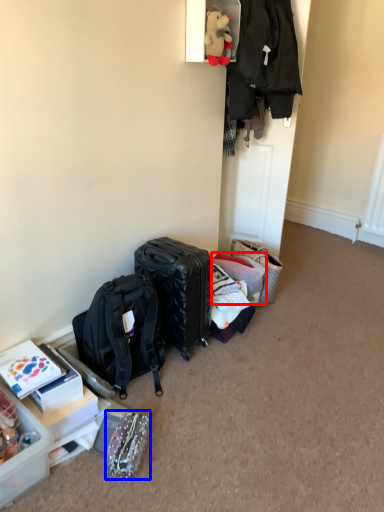
Question: Which object is closer to the camera taking this photo, suitcase (highlighted by a red box) or bag (highlighted by a blue box)?

Choices:
 (A) suitcase
 (B) bag

Answer: (B)